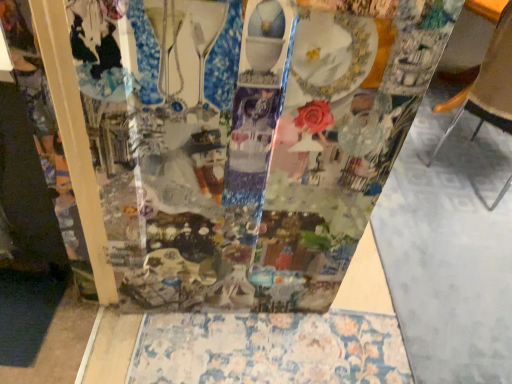
Question: Is floral-patterned fabric at lower center touching transparent plastic collage at center?

Choices:
 (A) yes
 (B) no

Answer: (B)

Question: Considering the relative sizes of floral-patterned fabric at lower center and transparent plastic collage at center in the image provided, is floral-patterned fabric at lower center taller than transparent plastic collage at center?

Choices:
 (A) no
 (B) yes

Answer: (A)

Question: Does floral-patterned fabric at lower center have a lesser height compared to transparent plastic collage at center?

Choices:
 (A) no
 (B) yes

Answer: (B)

Question: Could you tell me if floral-patterned fabric at lower center is turned towards transparent plastic collage at center?

Choices:
 (A) yes
 (B) no

Answer: (B)

Question: Is floral-patterned fabric at lower center at the right side of transparent plastic collage at center?

Choices:
 (A) no
 (B) yes

Answer: (B)

Question: In terms of width, does floral-patterned fabric at lower center look wider or thinner when compared to brown leather chair at right?

Choices:
 (A) wide
 (B) thin

Answer: (A)

Question: Does point (249, 327) appear closer or farther from the camera than point (487, 49)?

Choices:
 (A) farther
 (B) closer

Answer: (B)

Question: Is floral-patterned fabric at lower center inside the boundaries of brown leather chair at right, or outside?

Choices:
 (A) outside
 (B) inside

Answer: (A)

Question: From a real-world perspective, is floral-patterned fabric at lower center above or below brown leather chair at right?

Choices:
 (A) above
 (B) below

Answer: (B)

Question: From a real-world perspective, is transparent plastic collage at center above or below floral-patterned fabric at lower center?

Choices:
 (A) above
 (B) below

Answer: (A)

Question: Do you think transparent plastic collage at center is within floral-patterned fabric at lower center, or outside of it?

Choices:
 (A) inside
 (B) outside

Answer: (B)

Question: Looking at the image, does transparent plastic collage at center seem bigger or smaller compared to floral-patterned fabric at lower center?

Choices:
 (A) big
 (B) small

Answer: (A)

Question: Considering the positions of point (354, 1) and point (367, 352), is point (354, 1) closer or farther from the camera than point (367, 352)?

Choices:
 (A) closer
 (B) farther

Answer: (A)

Question: Is brown leather chair at right bigger or smaller than transparent plastic collage at center?

Choices:
 (A) big
 (B) small

Answer: (A)

Question: Based on their positions, is brown leather chair at right located to the left or right of transparent plastic collage at center?

Choices:
 (A) left
 (B) right

Answer: (B)